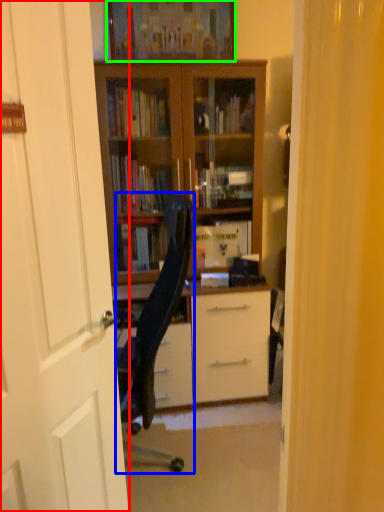
Question: Which is nearer to the door (highlighted by a red box)? chair (highlighted by a blue box) or picture frame (highlighted by a green box).

Choices:
 (A) chair
 (B) picture frame

Answer: (A)